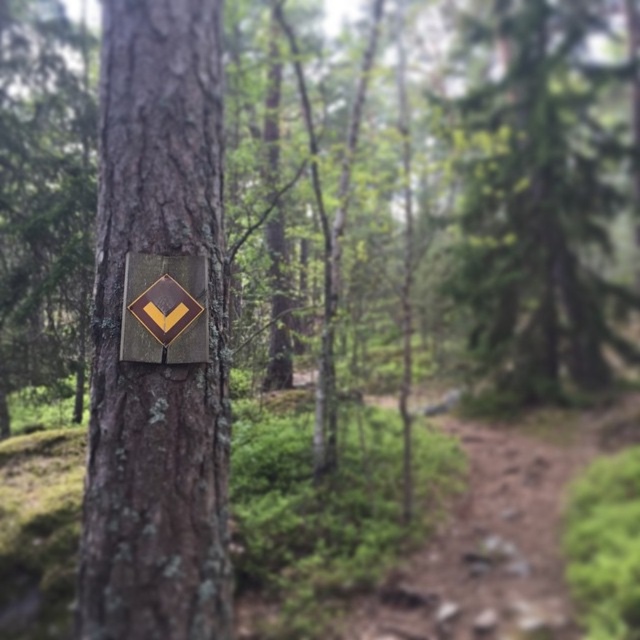
You are a hiker with a 2.5 meter long rope. You want to reach a point located at point [168,204]. Can your rope reach that point from your current position?

The point [168,204] is 2.25 meters from camera, so yes, the rope can reach it since it is shorter than the rope length.

You are a hiker trying to follow the direction indicated by the metallic gold diamond at center. According to the scene, where should you look for the next sign or marker relative to the green textured tree at center?

The metallic gold diamond at center is located below the green textured tree at center, so the next sign or marker should be found below the green textured tree at center following the downward direction of the arrow.

You are a hiker trying to read the sign on the green textured tree at center. The metallic gold diamond at center has an arrow pointing downward. Since the tree is wider than the diamond, can you see the entire diamond while looking at the tree?

The green textured tree at center is wider than the metallic gold diamond at center, so yes, you can see the entire diamond while looking at the tree because the tree is wider and likely covers more area, allowing the diamond to be fully visible within its structure.